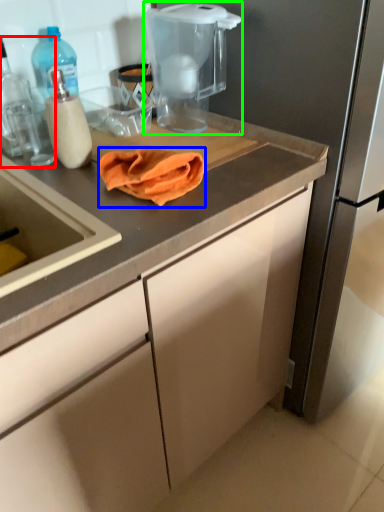
Question: Estimate the real-world distances between objects in this image. Which object is closer to kitchen appliance (highlighted by a red box), blanket (highlighted by a blue box) or home appliance (highlighted by a green box)?

Choices:
 (A) blanket
 (B) home appliance

Answer: (A)